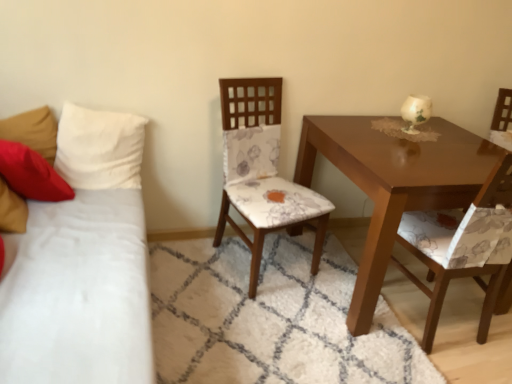
The height and width of the screenshot is (384, 512). What are the coordinates of `white fabric pillow at left, which is the 1th pillow in right-to-left order` in the screenshot? It's located at (99, 148).

You are a GUI agent. You are given a task and a screenshot of the screen. Output one action in this format:
    pyautogui.click(x=<x>, y=<y>)
    Task: Click on the glossy wood table at center right
    This screenshot has width=512, height=384.
    Given the screenshot: What is the action you would take?
    pyautogui.click(x=393, y=184)

Where is `floral fabric chair at center, the first chair viewed from the left`? floral fabric chair at center, the first chair viewed from the left is located at coordinates (262, 171).

Identify the location of white fabric studio couch at left. (83, 264).

Can you confirm if white fabric studio couch at left is wider than glossy wood table at center right?

Incorrect, the width of white fabric studio couch at left does not surpass that of glossy wood table at center right.

Is point (108, 146) farther from viewer compared to point (480, 168)?

Yes.

How distant is white fabric studio couch at left from glossy wood table at center right?

They are 1.14 meters apart.

Consider the image. Is white fabric studio couch at left not close to glossy wood table at center right?

Yes.

From a real-world perspective, is velvety red pillow at left, placed as the first pillow when sorted from left to right, under floral fabric chair at center, marked as the second chair in a right-to-left arrangement?

No, from a real-world perspective, velvety red pillow at left, placed as the first pillow when sorted from left to right, is not under floral fabric chair at center, marked as the second chair in a right-to-left arrangement.

Is point (16, 160) positioned in front of point (227, 187)?

Yes, point (16, 160) is in front of point (227, 187).

Is velvety red pillow at left, which is the second pillow in right-to-left order, oriented towards floral fabric chair at center, the first chair viewed from the left?

No.

Between white fabric studio couch at left and white fabric pillow at left, which is the second pillow from left to right, which one has less height?

white fabric pillow at left, which is the second pillow from left to right, is shorter.

Can you confirm if white fabric studio couch at left is thinner than white fabric pillow at left, which is the 1th pillow in right-to-left order?

No.

Is white fabric studio couch at left in contact with white fabric pillow at left, which is the 1th pillow in right-to-left order?

No, white fabric studio couch at left is not touching white fabric pillow at left, which is the 1th pillow in right-to-left order.

From the picture: Visually, is white fabric studio couch at left positioned to the left or to the right of white fabric pillow at left, which is the 1th pillow in right-to-left order?

white fabric studio couch at left is positioned on white fabric pillow at left, which is the 1th pillow in right-to-left order,'s right side.

From the image's perspective, count 2nd pillows upward from the glossy wood table at center right and point to it. Please provide its 2D coordinates.

[(99, 148)]

Does point (109, 116) appear closer or farther from the camera than point (301, 174)?

Clearly, point (109, 116) is closer to the camera than point (301, 174).

From the image's perspective, which one is positioned higher, white fabric pillow at left, which is the 1th pillow in right-to-left order, or glossy wood table at center right?

white fabric pillow at left, which is the 1th pillow in right-to-left order.

From the picture: Is the surface of glossy wood table at center right in direct contact with floral fabric chair at center, the first chair viewed from the left?

No, glossy wood table at center right is not next to floral fabric chair at center, the first chair viewed from the left.

Does glossy wood table at center right have a lesser width compared to floral fabric chair at center, marked as the second chair in a right-to-left arrangement?

No, glossy wood table at center right is not thinner than floral fabric chair at center, marked as the second chair in a right-to-left arrangement.

Who is shorter, glossy wood table at center right or floral fabric chair at center, marked as the second chair in a right-to-left arrangement?

glossy wood table at center right.

Is glossy wood table at center right at the left side of white fabric studio couch at left?

Incorrect, glossy wood table at center right is not on the left side of white fabric studio couch at left.

Between glossy wood table at center right and white fabric studio couch at left, which one has smaller size?

Smaller between the two is glossy wood table at center right.

What's the angular difference between glossy wood table at center right and white fabric studio couch at left's facing directions?

87.9 degrees separate the facing orientations of glossy wood table at center right and white fabric studio couch at left.

From a real-world perspective, is glossy wood table at center right physically above white fabric studio couch at left?

No, from a real-world perspective, glossy wood table at center right is not on top of white fabric studio couch at left.

How much distance is there between glossy wood table at center right and velvety red pillow at left, which is the second pillow in right-to-left order?

1.45 meters.

Starting from the glossy wood table at center right, which pillow is the 2nd one to the left? Please provide its 2D coordinates.

[(31, 174)]

Consider the image. Would you say velvety red pillow at left, placed as the first pillow when sorted from left to right, is part of glossy wood table at center right's contents?

No, velvety red pillow at left, placed as the first pillow when sorted from left to right, is not inside glossy wood table at center right.

Who is shorter, glossy wood table at center right or velvety red pillow at left, placed as the first pillow when sorted from left to right?

velvety red pillow at left, placed as the first pillow when sorted from left to right, is shorter.

At what (x,y) coordinates should I click in order to perform the action: click on table behind the white fabric studio couch at left. Please return your answer as a coordinate pair (x, y). This screenshot has width=512, height=384. Looking at the image, I should click on (393, 184).

What are the coordinates of `the 2nd pillow counting from the left side of the floral fabric chair at center, marked as the second chair in a right-to-left arrangement` in the screenshot? It's located at (31, 174).

Based on their spatial positions, is white fabric pillow at left, which is the 1th pillow in right-to-left order, or glossy wood table at center right closer to velvety red pillow at left, which is the second pillow in right-to-left order?

white fabric pillow at left, which is the 1th pillow in right-to-left order, lies closer to velvety red pillow at left, which is the second pillow in right-to-left order, than the other object.

When comparing their distances from white fabric studio couch at left, does glossy wood table at center right or white fabric pillow at left, which is the second pillow from left to right, seem further?

glossy wood table at center right lies further to white fabric studio couch at left than the other object.

Based on their spatial positions, is velvety red pillow at left, placed as the first pillow when sorted from left to right, or floral fabric chair at center, marked as the second chair in a right-to-left arrangement, further from floral fabric chair at right, which is the 2th chair from left to right?

velvety red pillow at left, placed as the first pillow when sorted from left to right, is further to floral fabric chair at right, which is the 2th chair from left to right.

From the image, which object appears to be farther from white fabric pillow at left, which is the 1th pillow in right-to-left order, floral fabric chair at center, marked as the second chair in a right-to-left arrangement, or glossy wood table at center right?

glossy wood table at center right is positioned further to the anchor white fabric pillow at left, which is the 1th pillow in right-to-left order.

Based on their spatial positions, is floral fabric chair at right, which is the 2th chair from left to right, or floral fabric chair at center, marked as the second chair in a right-to-left arrangement, further from glossy wood table at center right?

floral fabric chair at center, marked as the second chair in a right-to-left arrangement, lies further to glossy wood table at center right than the other object.

From the image, which object appears to be farther from white fabric pillow at left, which is the 1th pillow in right-to-left order, white fabric studio couch at left or floral fabric chair at right, which ranks as the first chair in right-to-left order?

Among the two, floral fabric chair at right, which ranks as the first chair in right-to-left order, is located further to white fabric pillow at left, which is the 1th pillow in right-to-left order.

When comparing their distances from velvety red pillow at left, which is the second pillow in right-to-left order, does white fabric pillow at left, which is the second pillow from left to right, or floral fabric chair at center, marked as the second chair in a right-to-left arrangement, seem closer?

white fabric pillow at left, which is the second pillow from left to right, lies closer to velvety red pillow at left, which is the second pillow in right-to-left order, than the other object.

When comparing their distances from glossy wood table at center right, does white fabric studio couch at left or white fabric pillow at left, which is the second pillow from left to right, seem closer?

white fabric studio couch at left is positioned closer to the anchor glossy wood table at center right.

I want to click on chair located between velvety red pillow at left, which is the second pillow in right-to-left order, and floral fabric chair at right, which is the 2th chair from left to right, in the left-right direction, so click(x=262, y=171).

Locate an element on the screen. chair located between white fabric pillow at left, which is the 1th pillow in right-to-left order, and floral fabric chair at right, which ranks as the first chair in right-to-left order, in the left-right direction is located at coordinates (262, 171).

The width and height of the screenshot is (512, 384). What are the coordinates of `studio couch between white fabric pillow at left, which is the 1th pillow in right-to-left order, and glossy wood table at center right, in the horizontal direction` in the screenshot? It's located at (83, 264).

This screenshot has height=384, width=512. I want to click on table between white fabric studio couch at left and floral fabric chair at right, which ranks as the first chair in right-to-left order, so click(393, 184).